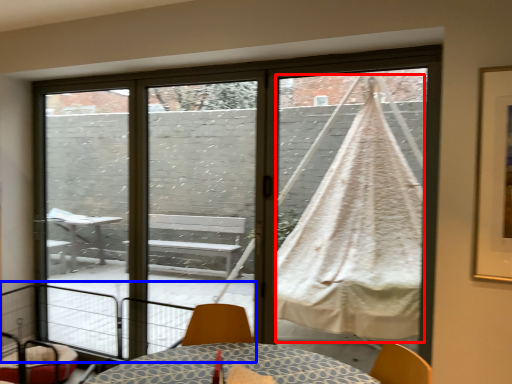
Question: Which of the following is the closest to the observer, blanket (highlighted by a red box) or balcony (highlighted by a blue box)?

Choices:
 (A) blanket
 (B) balcony

Answer: (B)